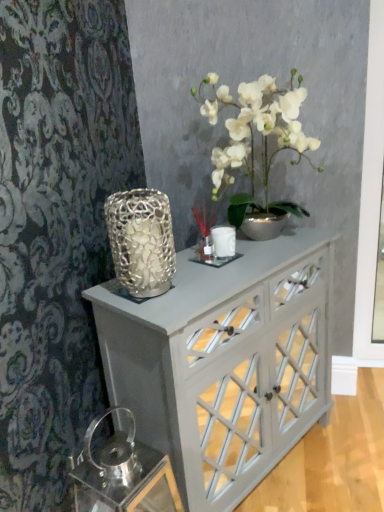
What do you see at coordinates (224, 362) in the screenshot?
I see `white painted wood cabinet at center` at bounding box center [224, 362].

What is the approximate width of white painted wood cabinet at center?

It is 19.72 inches.

Locate an element on the screen. white painted wood cabinet at center is located at coordinates (224, 362).

You are a GUI agent. You are given a task and a screenshot of the screen. Output one action in this format:
    pyautogui.click(x=<x>, y=<y>)
    Task: Click on the white painted wood cabinet at center
    
    Given the screenshot: What is the action you would take?
    pyautogui.click(x=224, y=362)